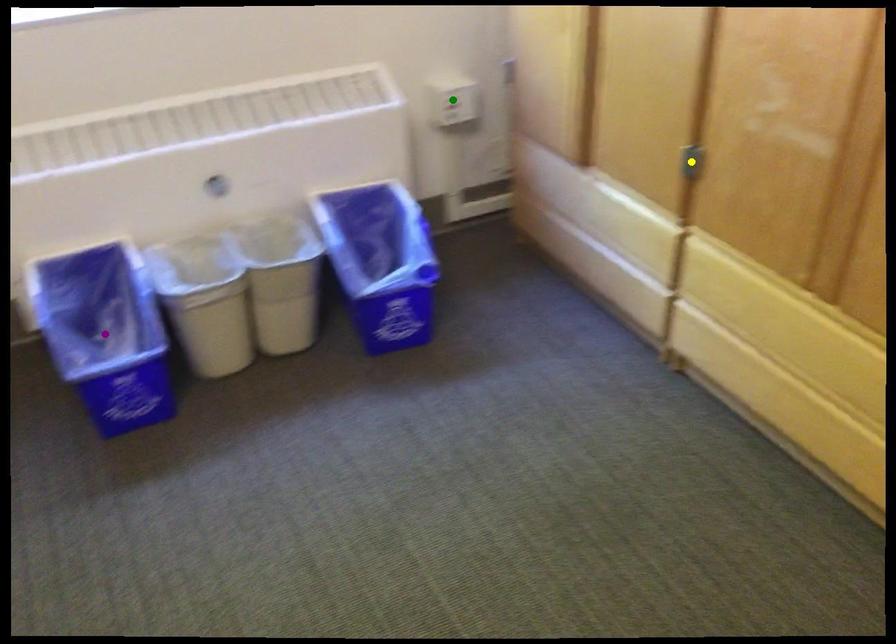
Order these from nearest to farthest:
yellow point, purple point, green point

1. yellow point
2. purple point
3. green point